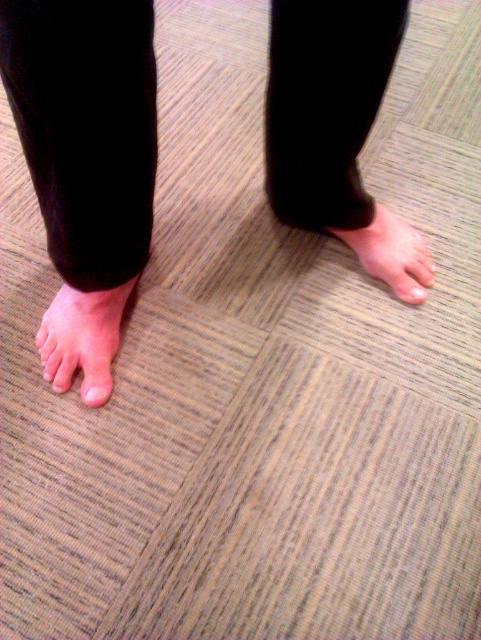
Between point (83, 384) and point (412, 294), which one is positioned behind?

Positioned behind is point (412, 294).

Where is `white matte toe at lower left`? Image resolution: width=481 pixels, height=640 pixels. white matte toe at lower left is located at coordinates (96, 392).

Does point (97, 388) lie in front of point (418, 300)?

Yes, it is in front of point (418, 300).

Find the location of `white matte toe at lower left`. white matte toe at lower left is located at coordinates (96, 392).

Between skinny bare feet at center and pink flesh-toned foot at lower left, which one has more height?

With more height is skinny bare feet at center.

Between skinny bare feet at center and pink flesh-toned foot at lower left, which one is positioned higher?

skinny bare feet at center is above.

Does point (91, 323) lie behind point (41, 346)?

No, (91, 323) is in front of (41, 346).

Where is `skinny bare feet at center`? Image resolution: width=481 pixels, height=640 pixels. skinny bare feet at center is located at coordinates (86, 161).

Is pink skin at center above pale skin toe at center?

Correct, pink skin at center is located above pale skin toe at center.

Is pink skin at center bigger than pale skin toe at center?

Indeed, pink skin at center has a larger size compared to pale skin toe at center.

The height and width of the screenshot is (640, 481). Find the location of `pink skin at center`. pink skin at center is located at coordinates (391, 252).

The image size is (481, 640). What are the coordinates of `pink skin at center` in the screenshot? It's located at (391, 252).